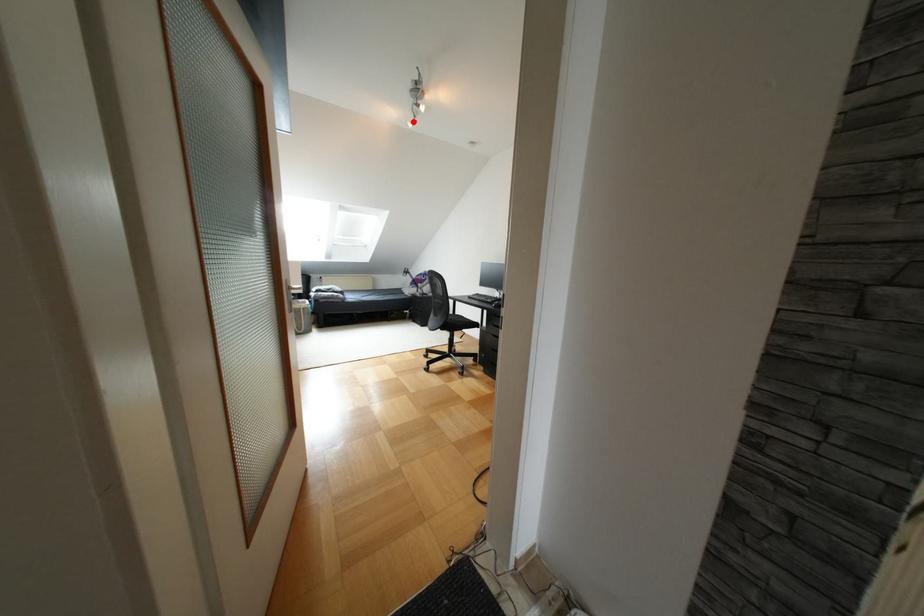
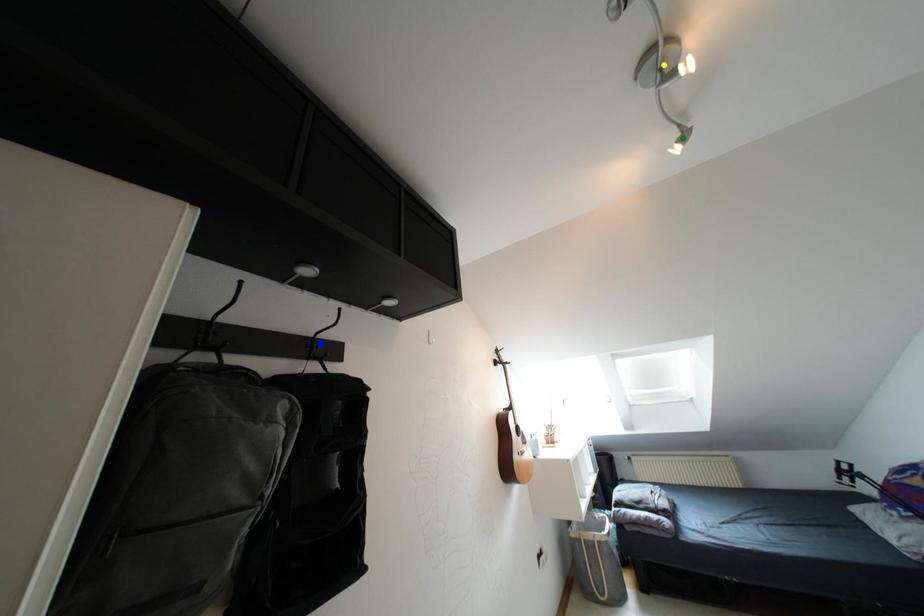
Question: I am providing you with two images of the same scene from different viewpoints. A red point is marked on the first image. You are given multiple points on the second image. In image 2, which mark is for the same physical point as the one in image 1?

Choices:
 (A) blue point
 (B) yellow point
 (C) green point

Answer: (C)